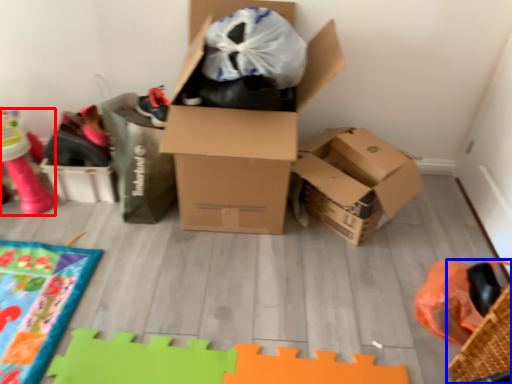
Question: Among these objects, which one is nearest to the camera, toy (highlighted by a red box) or basket (highlighted by a blue box)?

Choices:
 (A) toy
 (B) basket

Answer: (B)